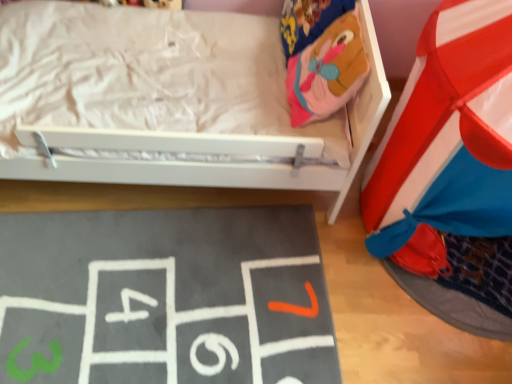
Question: Is velvet pink plush bean bag at upper right bigger or smaller than gray felt hopscotch at lower left?

Choices:
 (A) small
 (B) big

Answer: (B)

Question: From the image's perspective, is velvet pink plush bean bag at upper right positioned above or below gray felt hopscotch at lower left?

Choices:
 (A) above
 (B) below

Answer: (A)

Question: Is point (x=305, y=119) positioned closer to the camera than point (x=74, y=345)?

Choices:
 (A) farther
 (B) closer

Answer: (A)

Question: From the image's perspective, relative to velvet pink plush bean bag at upper right, is gray felt hopscotch at lower left above or below?

Choices:
 (A) above
 (B) below

Answer: (B)

Question: Does point (9, 253) appear closer or farther from the camera than point (343, 104)?

Choices:
 (A) closer
 (B) farther

Answer: (B)

Question: In the image, is gray felt hopscotch at lower left positioned in front of or behind velvet pink plush bean bag at upper right?

Choices:
 (A) front
 (B) behind

Answer: (A)

Question: Considering the relative positions of gray felt hopscotch at lower left and velvet pink plush bean bag at upper right in the image provided, is gray felt hopscotch at lower left to the left or to the right of velvet pink plush bean bag at upper right?

Choices:
 (A) left
 (B) right

Answer: (A)